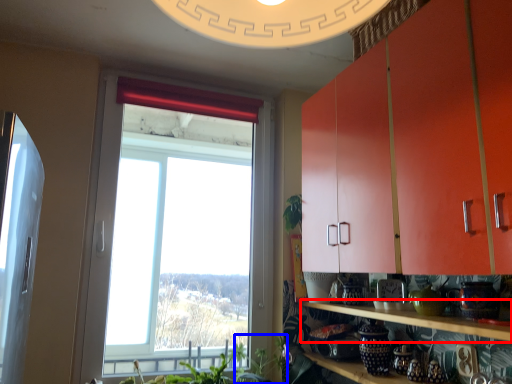
Question: Among these objects, which one is nearest to the camera, shelf (highlighted by a red box) or plant (highlighted by a blue box)?

Choices:
 (A) shelf
 (B) plant

Answer: (A)